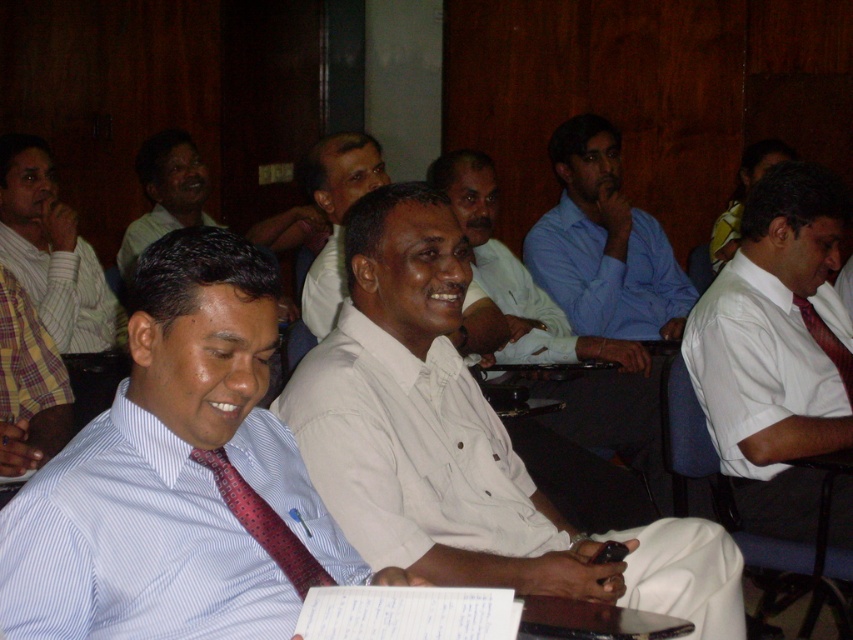
You are a photographer standing in the conference room. You want to take a photo of the striped cotton shirt at left and the matte green shirt at upper left. The camera you are using has a minimum focus distance of 16 inches. Will both shirts be in focus?

The striped cotton shirt at left is 17.05 inches away from the matte green shirt at upper left. Since the minimum focus distance is 16 inches, the camera can focus on both shirts as they are within the required distance.